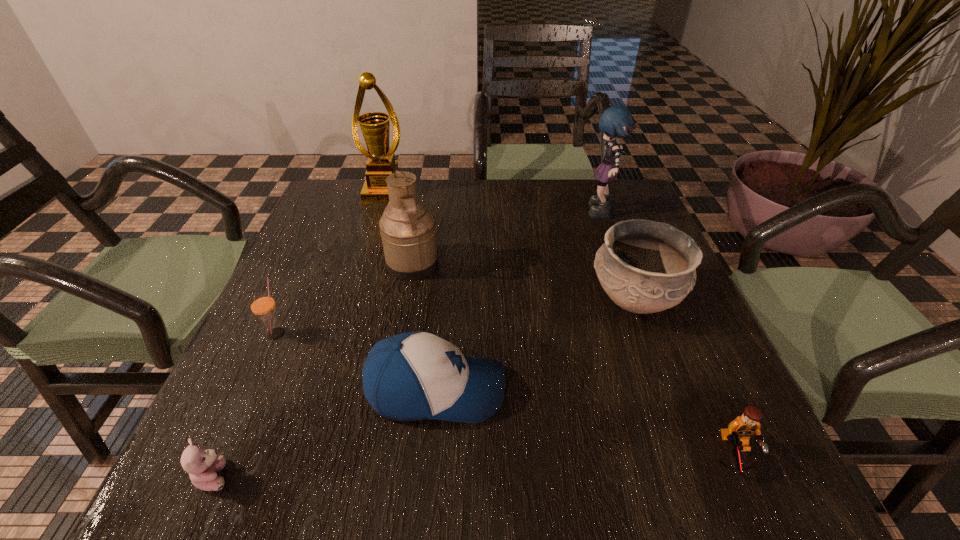
Identify the location of award. The image size is (960, 540). [381, 163].

This screenshot has height=540, width=960. Find the location of `rag doll`. rag doll is located at coordinates (616, 121).

You are a GUI agent. You are given a task and a screenshot of the screen. Output one action in this format:
    pyautogui.click(x=<x>, y=<y>)
    Task: Click on the sixth shortest object
    
    Given the screenshot: What is the action you would take?
    pyautogui.click(x=407, y=228)

In order to click on pottery in this screenshot , I will do `click(644, 266)`.

I want to click on straw, so click(262, 304).

What are the coordinates of `baseball cap` in the screenshot? It's located at (411, 376).

The height and width of the screenshot is (540, 960). I want to click on Lego, so click(739, 431).

Identify the location of teddy bear. (202, 465).

Locate an element on the screen. The image size is (960, 540). blank space located 0.150m on the front-facing side of the award is located at coordinates (372, 233).

Image resolution: width=960 pixels, height=540 pixels. Find the location of `blank space located 0.270m on the front-facing side of the second tallest object`. blank space located 0.270m on the front-facing side of the second tallest object is located at coordinates (487, 214).